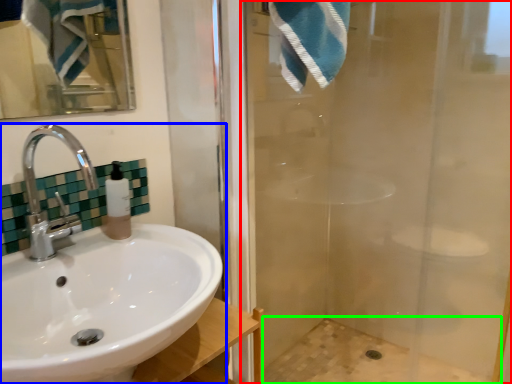
Question: Which object is positioned closest to shower door (highlighted by a red box)? Select from sink (highlighted by a blue box) and bath (highlighted by a green box).

Choices:
 (A) sink
 (B) bath

Answer: (B)